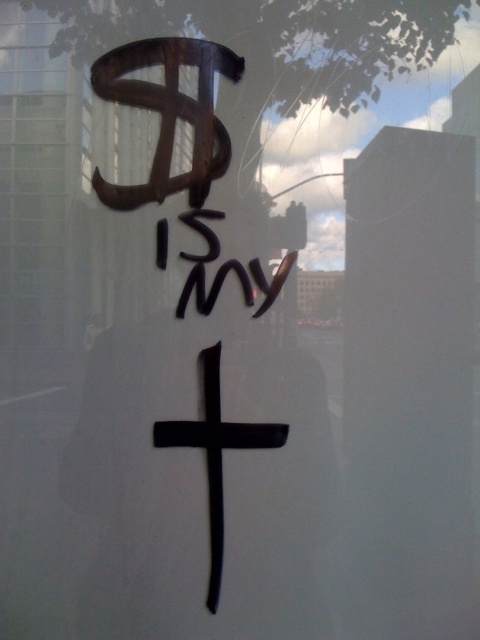
Question: Considering the relative positions of black matte cross at center and black ink writing at center in the image provided, where is black matte cross at center located with respect to black ink writing at center?

Choices:
 (A) right
 (B) left

Answer: (A)

Question: Can you confirm if black matte cross at center is thinner than black ink writing at center?

Choices:
 (A) yes
 (B) no

Answer: (A)

Question: Which object appears closest to the camera in this image?

Choices:
 (A) black matte cross at center
 (B) black ink writing at center

Answer: (A)

Question: Can you confirm if black matte cross at center is bigger than black ink writing at center?

Choices:
 (A) yes
 (B) no

Answer: (A)

Question: Which of the following is the closest to the observer?

Choices:
 (A) click(195, 209)
 (B) click(237, 444)

Answer: (B)